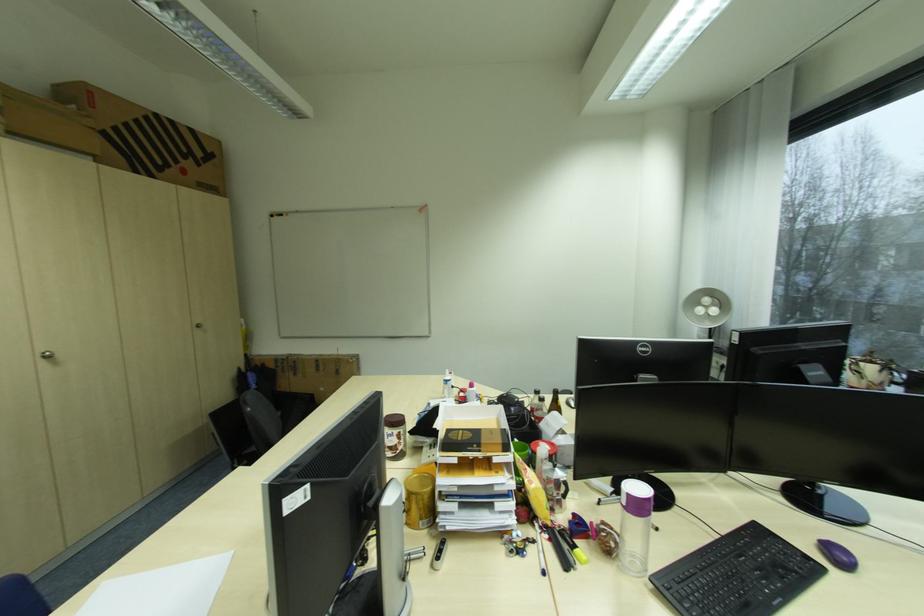
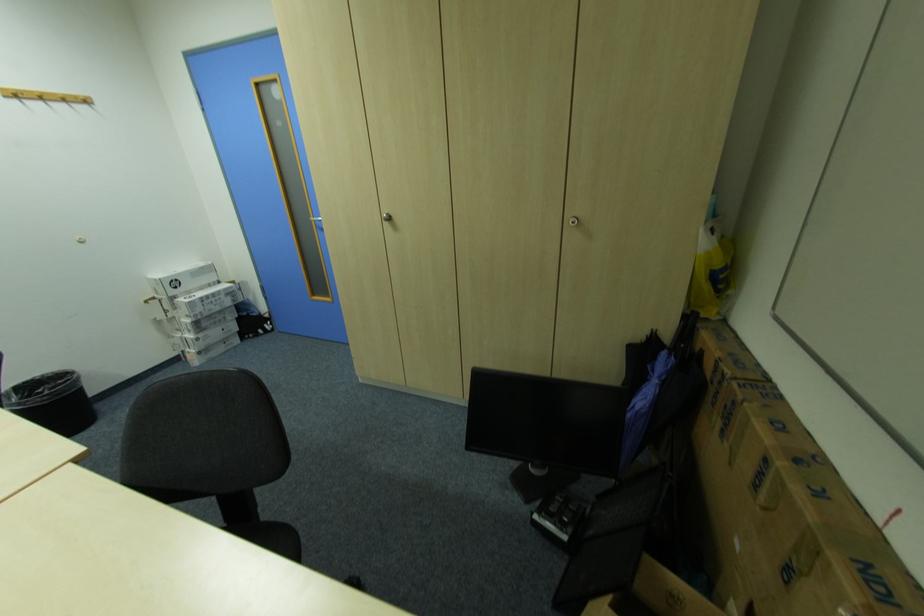
The point at (332, 371) is marked in the first image. Where is the corresponding point in the second image?

(772, 509)